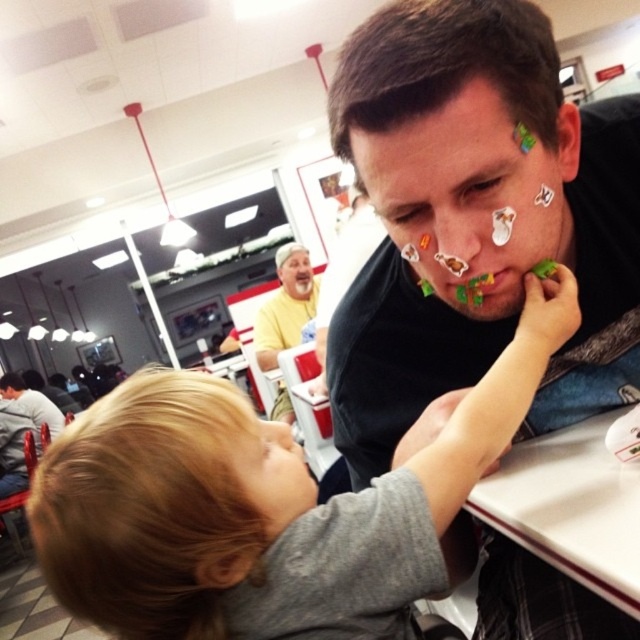
Question: Is yellow matte shirt at upper center to the left of smooth yellow face at center from the viewer's perspective?

Choices:
 (A) no
 (B) yes

Answer: (B)

Question: Which object is the closest to the matte black shirt at center?

Choices:
 (A) matte brown hair at center
 (B) blonde hair at lower left
 (C) yellow matte shirt at upper center

Answer: (A)

Question: Does multicolored stickers at center come behind green matte stickers at mouth center?

Choices:
 (A) yes
 (B) no

Answer: (B)

Question: Which object is closer to the camera taking this photo?

Choices:
 (A) smooth yellow face at center
 (B) blonde hair at lower left
 (C) multicolored stickers at center

Answer: (C)

Question: Which point is closer to the camera?

Choices:
 (A) matte black shirt at center
 (B) yellow matte shirt at upper center

Answer: (A)

Question: Can you confirm if yellow matte shirt at upper center is bigger than smooth yellow face at center?

Choices:
 (A) no
 (B) yes

Answer: (B)